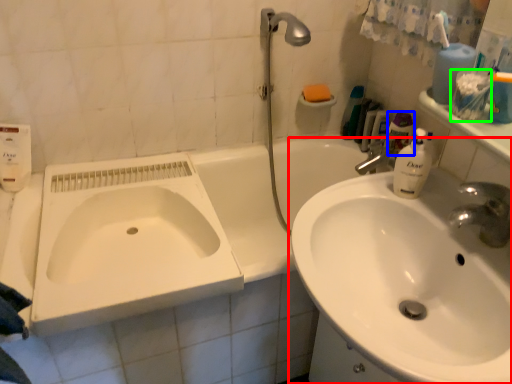
Question: Which is nearer to the sink (highlighted by a red box)? toiletry (highlighted by a blue box) or mouthwash (highlighted by a green box).

Choices:
 (A) toiletry
 (B) mouthwash

Answer: (B)